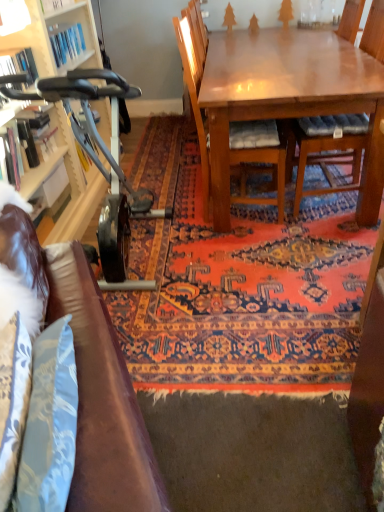
Question: Can you confirm if metallic gray exercise bike at left is bigger than wooden chair with cushion at center, the 2th chair in the left-to-right sequence?

Choices:
 (A) yes
 (B) no

Answer: (A)

Question: Can you confirm if metallic gray exercise bike at left is smaller than wooden chair with cushion at center, which ranks as the 1th chair in right-to-left order?

Choices:
 (A) no
 (B) yes

Answer: (A)

Question: Is metallic gray exercise bike at left turned away from wooden chair with cushion at center, the 2th chair in the left-to-right sequence?

Choices:
 (A) yes
 (B) no

Answer: (B)

Question: From the image's perspective, is metallic gray exercise bike at left above wooden chair with cushion at center, which ranks as the 1th chair in right-to-left order?

Choices:
 (A) yes
 (B) no

Answer: (B)

Question: Is metallic gray exercise bike at left at the right side of wooden chair with cushion at center, the 2th chair in the left-to-right sequence?

Choices:
 (A) yes
 (B) no

Answer: (B)

Question: Is brown leather couch at lower left spatially inside wooden chair with cushion at center, the 2th chair in the left-to-right sequence, or outside of it?

Choices:
 (A) inside
 (B) outside

Answer: (B)

Question: From their relative heights in the image, would you say brown leather couch at lower left is taller or shorter than wooden chair with cushion at center, the 2th chair in the left-to-right sequence?

Choices:
 (A) tall
 (B) short

Answer: (B)

Question: From the image's perspective, is brown leather couch at lower left located above or below wooden chair with cushion at center, which ranks as the 1th chair in right-to-left order?

Choices:
 (A) above
 (B) below

Answer: (B)

Question: Considering the positions of brown leather couch at lower left and wooden chair with cushion at center, which ranks as the 1th chair in right-to-left order, in the image, is brown leather couch at lower left bigger or smaller than wooden chair with cushion at center, which ranks as the 1th chair in right-to-left order,?

Choices:
 (A) small
 (B) big

Answer: (A)

Question: From the image's perspective, relative to brown leather couch at lower left, is wooden bookshelf at left above or below?

Choices:
 (A) below
 (B) above

Answer: (B)

Question: In terms of height, does wooden bookshelf at left look taller or shorter compared to brown leather couch at lower left?

Choices:
 (A) short
 (B) tall

Answer: (A)

Question: Considering the positions of wooden bookshelf at left and brown leather couch at lower left in the image, is wooden bookshelf at left wider or thinner than brown leather couch at lower left?

Choices:
 (A) wide
 (B) thin

Answer: (A)

Question: Relative to brown leather couch at lower left, is wooden bookshelf at left in front or behind?

Choices:
 (A) front
 (B) behind

Answer: (B)

Question: Is carpeted rug at center bigger or smaller than wooden bookshelf at left?

Choices:
 (A) small
 (B) big

Answer: (B)

Question: Is point (349, 202) positioned closer to the camera than point (3, 128)?

Choices:
 (A) farther
 (B) closer

Answer: (A)